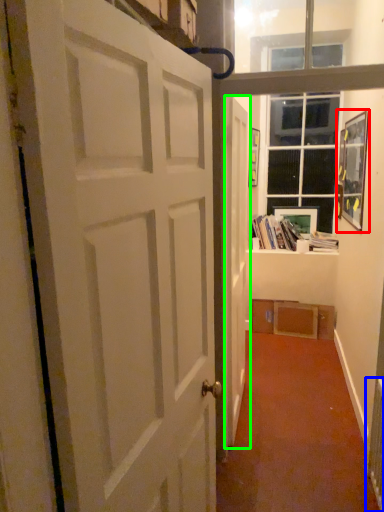
Question: Which object is the farthest from picture frame (highlighted by a red box)? Choose among these: radiator (highlighted by a blue box) or door (highlighted by a green box).

Choices:
 (A) radiator
 (B) door

Answer: (A)